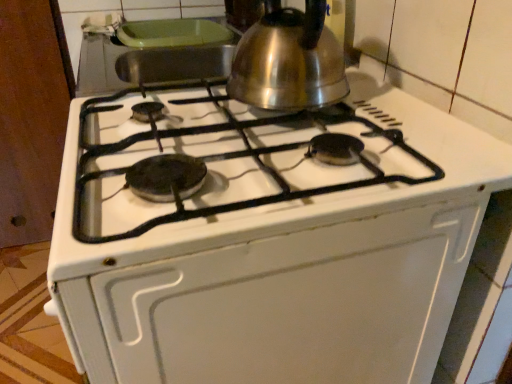
Identify the location of white matte oven at center. (281, 305).

Describe the element at coordinates (281, 305) in the screenshot. I see `white matte oven at center` at that location.

Based on the photo, measure the distance between point (253, 64) and camera.

A distance of 27.36 inches exists between point (253, 64) and camera.

Locate an element on the screen. satin silver kettle at upper center is located at coordinates (289, 61).

Describe the element at coordinates (289, 61) in the screenshot. I see `satin silver kettle at upper center` at that location.

You are a GUI agent. You are given a task and a screenshot of the screen. Output one action in this format:
    pyautogui.click(x=<x>, y=<y>)
    Task: Click on the white matte oven at center
    
    Given the screenshot: What is the action you would take?
    pyautogui.click(x=281, y=305)

Which is more to the right, white matte oven at center or satin silver kettle at upper center?

satin silver kettle at upper center is more to the right.

Which is behind, white matte oven at center or satin silver kettle at upper center?

satin silver kettle at upper center is behind.

Does point (367, 280) lie in front of point (271, 104)?

Yes.

From the image's perspective, is white matte oven at center positioned above or below satin silver kettle at upper center?

white matte oven at center is situated lower than satin silver kettle at upper center in the image.

From a real-world perspective, is white matte oven at center under satin silver kettle at upper center?

Yes.

Which object is wider, white matte oven at center or satin silver kettle at upper center?

Wider between the two is white matte oven at center.

Considering the sizes of objects white matte oven at center and satin silver kettle at upper center in the image provided, who is taller, white matte oven at center or satin silver kettle at upper center?

white matte oven at center.

Which of these two, white matte oven at center or satin silver kettle at upper center, is bigger?

Bigger between the two is white matte oven at center.

Consider the image. Is white matte oven at center outside of satin silver kettle at upper center?

Yes, white matte oven at center is outside of satin silver kettle at upper center.

Is white matte oven at center not close to satin silver kettle at upper center?

They are positioned close to each other.

Is white matte oven at center facing towards satin silver kettle at upper center?

No, white matte oven at center is not turned towards satin silver kettle at upper center.

How many degrees apart are the facing directions of white matte oven at center and satin silver kettle at upper center?

0.000917 degrees separate the facing orientations of white matte oven at center and satin silver kettle at upper center.

You are a GUI agent. You are given a task and a screenshot of the screen. Output one action in this format:
    pyautogui.click(x=<x>, y=<y>)
    Task: Click on the oven located underneath the satin silver kettle at upper center (from a real-world perspective)
    This screenshot has width=512, height=384.
    Given the screenshot: What is the action you would take?
    pyautogui.click(x=281, y=305)

Based on their positions, is satin silver kettle at upper center located to the left or right of white matte oven at center?

From the image, it's evident that satin silver kettle at upper center is to the right of white matte oven at center.

Between satin silver kettle at upper center and white matte oven at center, which one is positioned in front?

white matte oven at center.

Considering the points (251, 95) and (104, 296), which point is in front, point (251, 95) or point (104, 296)?

The point (104, 296) is in front.

From the image's perspective, would you say satin silver kettle at upper center is shown under white matte oven at center?

No.

From a real-world perspective, which is physically below, satin silver kettle at upper center or white matte oven at center?

white matte oven at center is physically lower.

Which object is wider, satin silver kettle at upper center or white matte oven at center?

Wider between the two is white matte oven at center.

Who is taller, satin silver kettle at upper center or white matte oven at center?

white matte oven at center.

Can you confirm if satin silver kettle at upper center is smaller than white matte oven at center?

Yes, satin silver kettle at upper center is smaller than white matte oven at center.

Is satin silver kettle at upper center positioned beyond the bounds of white matte oven at center?

Yes, satin silver kettle at upper center is outside of white matte oven at center.

Is satin silver kettle at upper center next to white matte oven at center and touching it?

No, satin silver kettle at upper center is not touching white matte oven at center.

Is satin silver kettle at upper center looking in the opposite direction of white matte oven at center?

satin silver kettle at upper center does not have its back to white matte oven at center.

From the picture: How different are the orientations of satin silver kettle at upper center and white matte oven at center in degrees?

The facing directions of satin silver kettle at upper center and white matte oven at center are 0.000917 degrees apart.

How far apart are satin silver kettle at upper center and white matte oven at center?

satin silver kettle at upper center and white matte oven at center are 13.90 inches apart from each other.

I want to click on kettle behind the white matte oven at center, so click(289, 61).

Where is `kettle behind the white matte oven at center`? The height and width of the screenshot is (384, 512). kettle behind the white matte oven at center is located at coordinates (289, 61).

Locate an element on the screen. oven that is in front of the satin silver kettle at upper center is located at coordinates (281, 305).